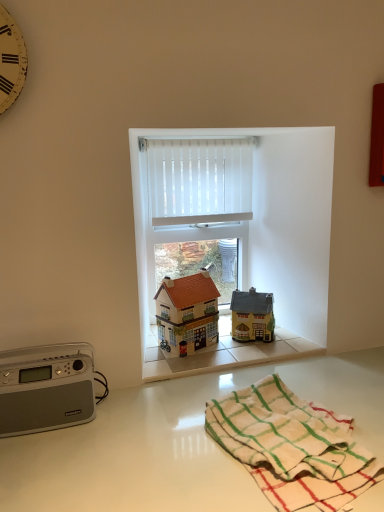
Question: Does matte brown house at center, which ranks as the 1th toy in left-to-right order, have a greater height compared to white vertical blinds at center?

Choices:
 (A) yes
 (B) no

Answer: (B)

Question: From a real-world perspective, is matte brown house at center, which ranks as the 1th toy in left-to-right order, over white vertical blinds at center?

Choices:
 (A) yes
 (B) no

Answer: (B)

Question: Is matte brown house at center, which ranks as the 1th toy in left-to-right order, positioned behind white vertical blinds at center?

Choices:
 (A) no
 (B) yes

Answer: (A)

Question: Is white vertical blinds at center at the back of matte brown house at center, the 2th toy from the right?

Choices:
 (A) yes
 (B) no

Answer: (B)

Question: Does point (43, 375) appear closer or farther from the camera than point (152, 181)?

Choices:
 (A) closer
 (B) farther

Answer: (A)

Question: Is silver metallic radio at left taller or shorter than white vertical blinds at center?

Choices:
 (A) short
 (B) tall

Answer: (A)

Question: Is silver metallic radio at left to the left or to the right of white vertical blinds at center in the image?

Choices:
 (A) right
 (B) left

Answer: (B)

Question: In the image, is silver metallic radio at left positioned in front of or behind white vertical blinds at center?

Choices:
 (A) behind
 (B) front

Answer: (B)

Question: Would you say matte yellow house at center, the 1th toy when ordered from right to left, is to the left or to the right of matte brown house at center, which ranks as the 1th toy in left-to-right order, in the picture?

Choices:
 (A) right
 (B) left

Answer: (A)

Question: Choose the correct answer: Is matte yellow house at center, the 1th toy when ordered from right to left, inside matte brown house at center, which ranks as the 1th toy in left-to-right order, or outside it?

Choices:
 (A) outside
 (B) inside

Answer: (A)

Question: Is point (269, 307) closer or farther from the camera than point (183, 316)?

Choices:
 (A) farther
 (B) closer

Answer: (A)

Question: From their relative heights in the image, would you say matte yellow house at center, the 1th toy when ordered from right to left, is taller or shorter than matte brown house at center, which ranks as the 1th toy in left-to-right order?

Choices:
 (A) short
 (B) tall

Answer: (A)

Question: Looking at the image, does matte brown house at center, the 2th toy from the right, seem bigger or smaller compared to white glossy countertop at lower center?

Choices:
 (A) big
 (B) small

Answer: (B)

Question: From the image's perspective, is matte brown house at center, the 2th toy from the right, located above or below white glossy countertop at lower center?

Choices:
 (A) below
 (B) above

Answer: (B)